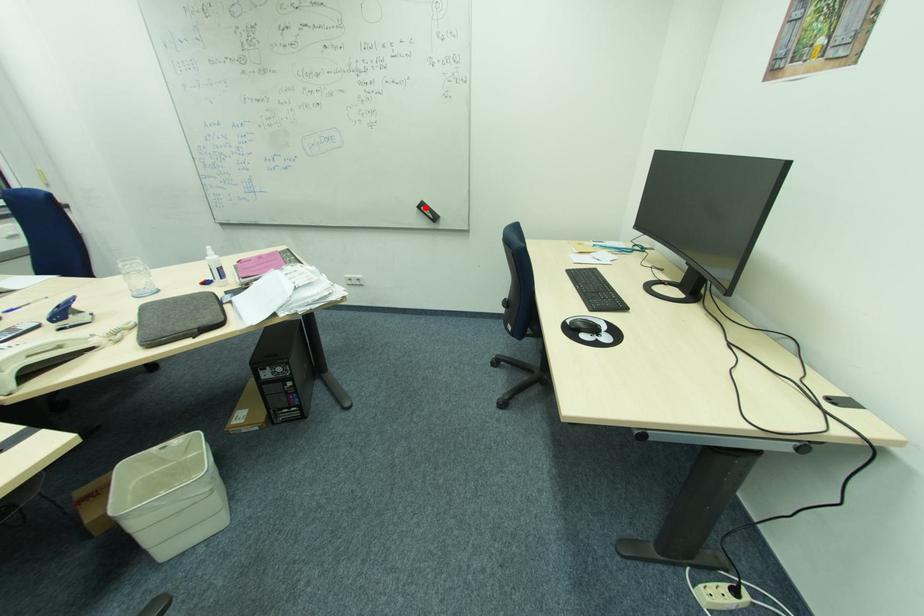
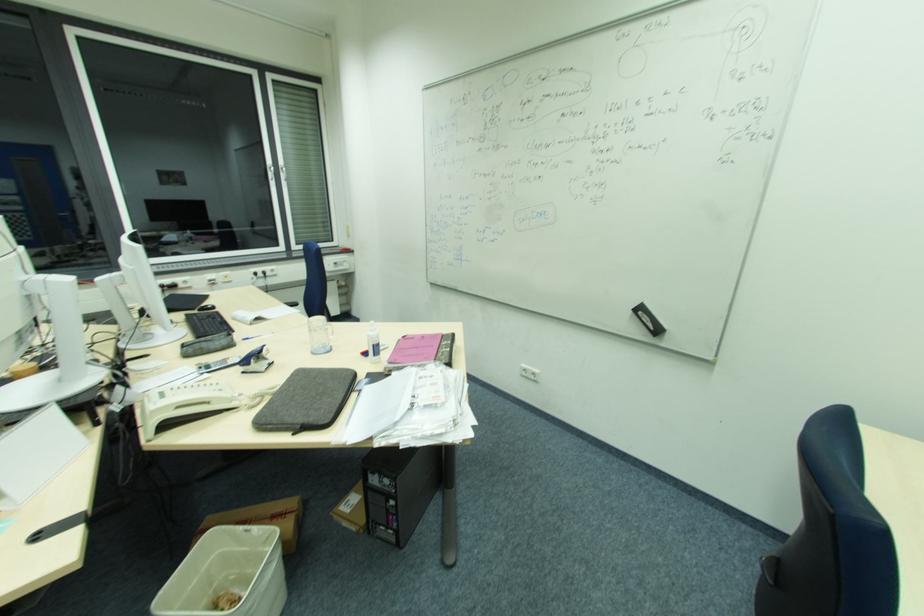
Find the pixel in the second image that matches the highlighted location in the first image.

(643, 314)